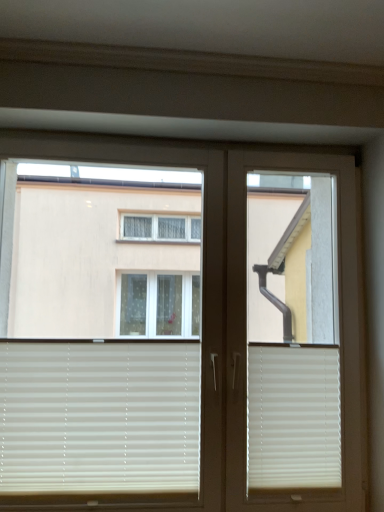
Measure the distance between point (252, 377) and camera.

The distance of point (252, 377) from camera is 5.15 feet.

At what (x,y) coordinates should I click in order to perform the action: click on white matte window at upper left. Please return your answer as a coordinate pair (x, y). Looking at the image, I should click on (202, 355).

At what (x,y) coordinates should I click in order to perform the action: click on beige matte blinds at lower left, the first window blind in the left-to-right sequence. Please return your answer as a coordinate pair (x, y). This screenshot has height=512, width=384. Looking at the image, I should click on (99, 417).

Describe the element at coordinates (292, 333) in the screenshot. This screenshot has width=384, height=512. I see `white plastic screen door at center` at that location.

Where is `white matte window blind at lower right, acting as the second window blind starting from the left`? The image size is (384, 512). white matte window blind at lower right, acting as the second window blind starting from the left is located at coordinates (293, 416).

Is white matte window blind at lower right, which ranks as the first window blind in right-to-left order, looking in the opposite direction of white plastic screen door at center?

Yes, white matte window blind at lower right, which ranks as the first window blind in right-to-left order, is facing away from white plastic screen door at center.

From a real-world perspective, is white matte window blind at lower right, acting as the second window blind starting from the left, under white plastic screen door at center?

Correct, in the physical world, white matte window blind at lower right, acting as the second window blind starting from the left, is lower than white plastic screen door at center.

Is white matte window blind at lower right, acting as the second window blind starting from the left, placed right next to white plastic screen door at center?

No, white matte window blind at lower right, acting as the second window blind starting from the left, is not next to white plastic screen door at center.

Which is behind, white matte window blind at lower right, which ranks as the first window blind in right-to-left order, or white plastic screen door at center?

white matte window blind at lower right, which ranks as the first window blind in right-to-left order, is more distant.

From the image's perspective, between white plastic screen door at center and white matte window blind at lower right, acting as the second window blind starting from the left, which one is located above?

white plastic screen door at center appears higher in the image.

Is white plastic screen door at center completely or partially outside of white matte window blind at lower right, acting as the second window blind starting from the left?

Indeed, white plastic screen door at center is completely outside white matte window blind at lower right, acting as the second window blind starting from the left.

From the picture: Between white plastic screen door at center and white matte window blind at lower right, acting as the second window blind starting from the left, which one has more height?

With more height is white plastic screen door at center.

From a real-world perspective, who is located lower, white plastic screen door at center or white matte window blind at lower right, acting as the second window blind starting from the left?

white matte window blind at lower right, acting as the second window blind starting from the left.

Consider the image. Considering the sizes of objects white matte window at upper left and white plastic screen door at center in the image provided, who is wider, white matte window at upper left or white plastic screen door at center?

white matte window at upper left is wider.

Does point (186, 307) come farther from viewer compared to point (287, 500)?

That is True.

Is white matte window at upper left closer to camera compared to white plastic screen door at center?

Yes, it is in front of white plastic screen door at center.

Is beige matte blinds at lower left, the first window blind in the left-to-right sequence, situated inside white matte window at upper left or outside?

beige matte blinds at lower left, the first window blind in the left-to-right sequence, is inside white matte window at upper left.

Between beige matte blinds at lower left, the first window blind in the left-to-right sequence, and white matte window at upper left, which one has more height?

white matte window at upper left.

Could you tell me if beige matte blinds at lower left, the first window blind in the left-to-right sequence, is turned towards white matte window at upper left?

Yes, beige matte blinds at lower left, the first window blind in the left-to-right sequence, is oriented towards white matte window at upper left.

Considering the sizes of objects beige matte blinds at lower left, which is counted as the 2th window blind, starting from the right, and white matte window at upper left in the image provided, who is thinner, beige matte blinds at lower left, which is counted as the 2th window blind, starting from the right, or white matte window at upper left?

With smaller width is beige matte blinds at lower left, which is counted as the 2th window blind, starting from the right.

Which object is positioned more to the right, beige matte blinds at lower left, the first window blind in the left-to-right sequence, or white matte window blind at lower right, which ranks as the first window blind in right-to-left order?

From the viewer's perspective, white matte window blind at lower right, which ranks as the first window blind in right-to-left order, appears more on the right side.

Can we say beige matte blinds at lower left, which is counted as the 2th window blind, starting from the right, lies outside white matte window blind at lower right, which ranks as the first window blind in right-to-left order?

Absolutely, beige matte blinds at lower left, which is counted as the 2th window blind, starting from the right, is external to white matte window blind at lower right, which ranks as the first window blind in right-to-left order.

Identify the location of window blind below the white matte window blind at lower right, acting as the second window blind starting from the left (from a real-world perspective). This screenshot has height=512, width=384. (99, 417).

Relative to white matte window blind at lower right, which ranks as the first window blind in right-to-left order, is beige matte blinds at lower left, which is counted as the 2th window blind, starting from the right, in front or behind?

Clearly, beige matte blinds at lower left, which is counted as the 2th window blind, starting from the right, is in front of white matte window blind at lower right, which ranks as the first window blind in right-to-left order.

Can you tell me how much white plastic screen door at center and white matte window at upper left differ in facing direction?

0.00116 degrees.

Does white plastic screen door at center have a greater height compared to white matte window at upper left?

Yes.

Would you say white plastic screen door at center is to the left or to the right of white matte window at upper left in the picture?

white plastic screen door at center is to the right of white matte window at upper left.

Which is closer to the camera, (312, 364) or (61, 468)?

Clearly, point (312, 364) is more distant from the camera than point (61, 468).

Could you tell me if white matte window at upper left is facing white matte window blind at lower right, which ranks as the first window blind in right-to-left order?

No, white matte window at upper left is not aimed at white matte window blind at lower right, which ranks as the first window blind in right-to-left order.

Considering the relative positions of white matte window at upper left and white matte window blind at lower right, which ranks as the first window blind in right-to-left order, in the image provided, is white matte window at upper left to the left of white matte window blind at lower right, which ranks as the first window blind in right-to-left order, from the viewer's perspective?

Yes, white matte window at upper left is to the left of white matte window blind at lower right, which ranks as the first window blind in right-to-left order.

Consider the image. From a real-world perspective, is white matte window at upper left below white matte window blind at lower right, acting as the second window blind starting from the left?

No.

Identify the location of screen door located above the white matte window blind at lower right, which ranks as the first window blind in right-to-left order (from the image's perspective). This screenshot has height=512, width=384. (292, 333).

The height and width of the screenshot is (512, 384). Find the location of `the 1st window blind positioned below the white plastic screen door at center (from a real-world perspective)`. the 1st window blind positioned below the white plastic screen door at center (from a real-world perspective) is located at coordinates point(293,416).

Based on their spatial positions, is white plastic screen door at center or white matte window at upper left closer to beige matte blinds at lower left, which is counted as the 2th window blind, starting from the right?

The object closer to beige matte blinds at lower left, which is counted as the 2th window blind, starting from the right, is white matte window at upper left.

From the image, which object appears to be nearer to white matte window blind at lower right, acting as the second window blind starting from the left, beige matte blinds at lower left, the first window blind in the left-to-right sequence, or white plastic screen door at center?

Based on the image, white plastic screen door at center appears to be nearer to white matte window blind at lower right, acting as the second window blind starting from the left.

When comparing their distances from beige matte blinds at lower left, which is counted as the 2th window blind, starting from the right, does white matte window blind at lower right, acting as the second window blind starting from the left, or white matte window at upper left seem closer?

white matte window at upper left is closer to beige matte blinds at lower left, which is counted as the 2th window blind, starting from the right.

Based on their spatial positions, is white matte window blind at lower right, acting as the second window blind starting from the left, or beige matte blinds at lower left, which is counted as the 2th window blind, starting from the right, further from white plastic screen door at center?

beige matte blinds at lower left, which is counted as the 2th window blind, starting from the right, is positioned further to the anchor white plastic screen door at center.

Looking at the image, which one is located closer to white plastic screen door at center, white matte window blind at lower right, acting as the second window blind starting from the left, or white matte window at upper left?

white matte window at upper left is closer to white plastic screen door at center.

Which object lies further to the anchor point white plastic screen door at center, beige matte blinds at lower left, which is counted as the 2th window blind, starting from the right, or white matte window blind at lower right, acting as the second window blind starting from the left?

beige matte blinds at lower left, which is counted as the 2th window blind, starting from the right, is further to white plastic screen door at center.

When comparing their distances from white matte window at upper left, does white plastic screen door at center or beige matte blinds at lower left, which is counted as the 2th window blind, starting from the right, seem further?

Among the two, beige matte blinds at lower left, which is counted as the 2th window blind, starting from the right, is located further to white matte window at upper left.

Which object lies further to the anchor point white matte window at upper left, beige matte blinds at lower left, the first window blind in the left-to-right sequence, or white matte window blind at lower right, acting as the second window blind starting from the left?

white matte window blind at lower right, acting as the second window blind starting from the left.

I want to click on window situated between beige matte blinds at lower left, which is counted as the 2th window blind, starting from the right, and white matte window blind at lower right, acting as the second window blind starting from the left, from left to right, so click(202, 355).

The image size is (384, 512). I want to click on window blind between white matte window at upper left and white plastic screen door at center in the horizontal direction, so click(293, 416).

Find the location of a particular element. Image resolution: width=384 pixels, height=512 pixels. window blind between beige matte blinds at lower left, the first window blind in the left-to-right sequence, and white plastic screen door at center is located at coordinates (293, 416).

The image size is (384, 512). Find the location of `window situated between beige matte blinds at lower left, the first window blind in the left-to-right sequence, and white plastic screen door at center from left to right`. window situated between beige matte blinds at lower left, the first window blind in the left-to-right sequence, and white plastic screen door at center from left to right is located at coordinates (202, 355).